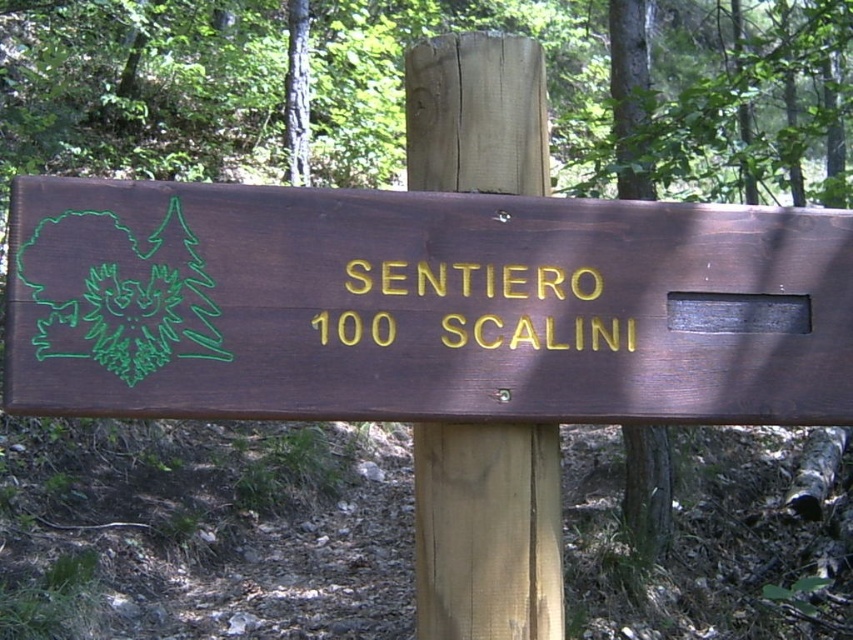
Question: Does brown wooden sign at center have a greater width compared to goldmaterial/texture sign at center?

Choices:
 (A) yes
 (B) no

Answer: (A)

Question: Considering the real-world distances, which object is farthest from the brown wood signpost at center?

Choices:
 (A) goldmaterial/texture sign at center
 (B) dark brown wood sign at center

Answer: (B)

Question: Which object is the farthest from the dark brown wood sign at center?

Choices:
 (A) goldmaterial/texture sign at center
 (B) brown wooden sign at center
 (C) brown wood signpost at center

Answer: (C)

Question: Based on their relative distances, which object is nearer to the dark brown wood sign at center?

Choices:
 (A) brown wood signpost at center
 (B) goldmaterial/texture sign at center
 (C) brown wooden sign at center

Answer: (B)

Question: Is goldmaterial/texture sign at center thinner than dark brown wood sign at center?

Choices:
 (A) no
 (B) yes

Answer: (A)

Question: Is brown wood signpost at center bigger than dark brown wood sign at center?

Choices:
 (A) no
 (B) yes

Answer: (B)